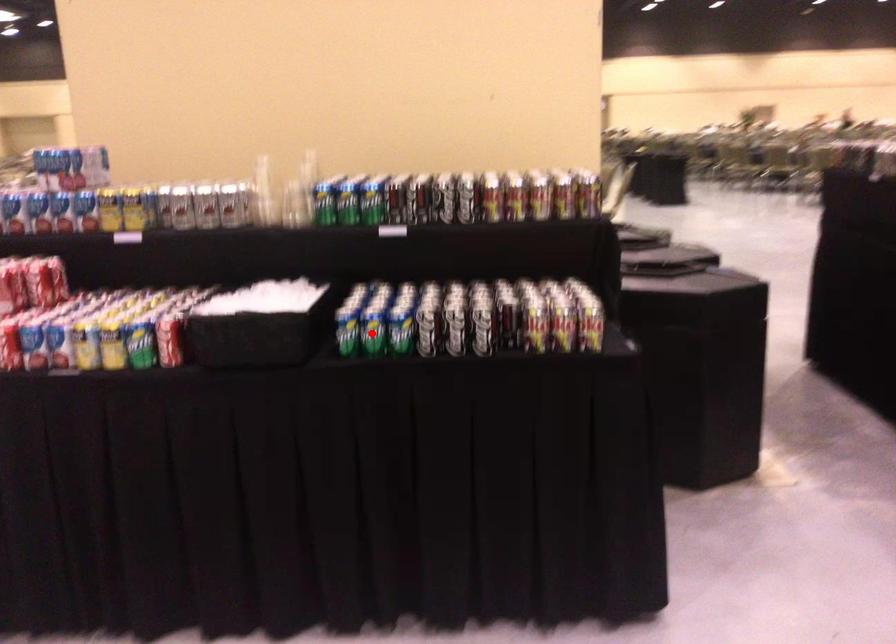
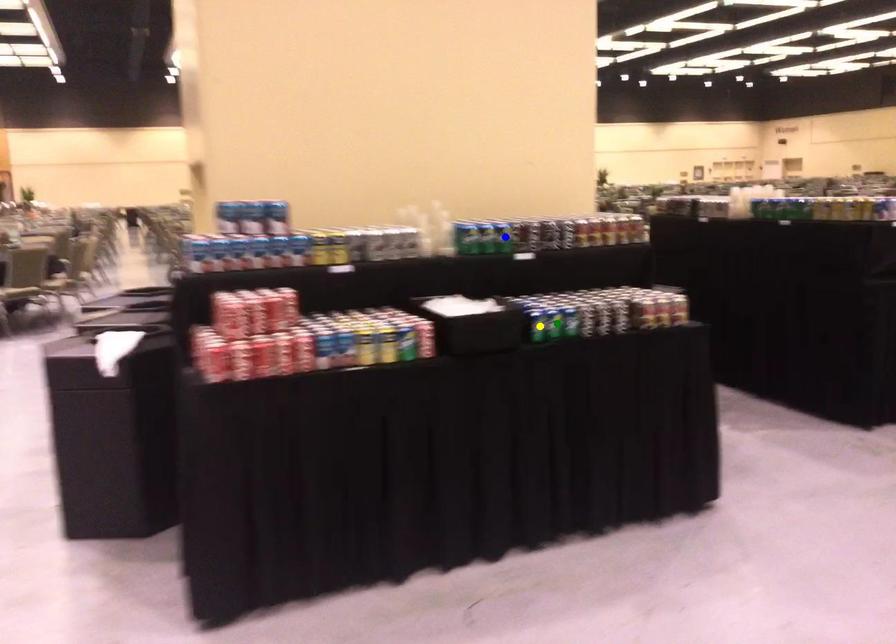
Question: I am providing you with two images of the same scene from different viewpoints. A red point is marked on the first image. You are given multiple points on the second image. In image 2, which mark is for the same physical point as the one in image 1?

Choices:
 (A) yellow point
 (B) green point
 (C) blue point

Answer: (B)